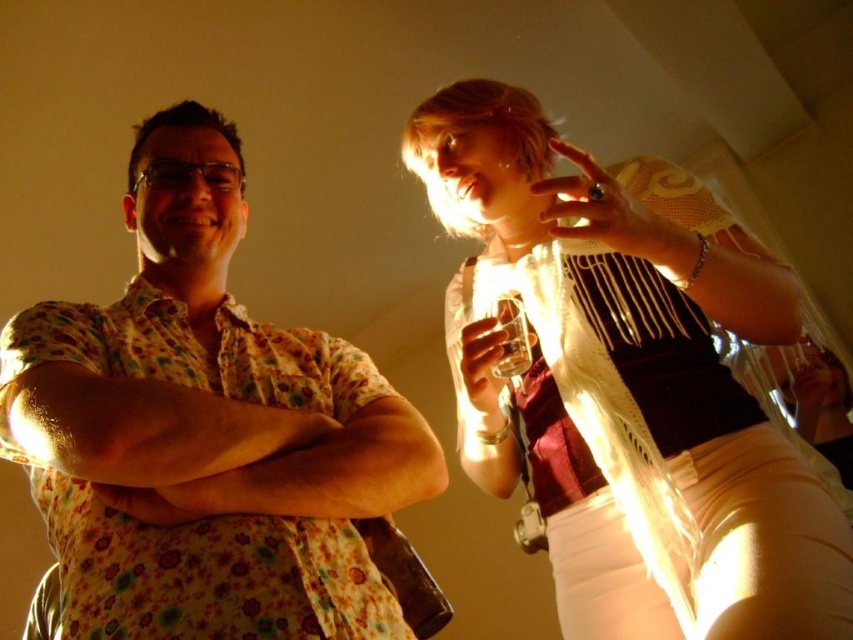
Which of these two, matte white scarf at upper right or floral cotton shirt at left, stands shorter?

Standing shorter between the two is floral cotton shirt at left.

Between matte white scarf at upper right and floral cotton shirt at left, which one is positioned lower?

matte white scarf at upper right is lower down.

Does point (668, 172) come behind point (189, 422)?

Yes, it is.

Where is `matte white scarf at upper right`? matte white scarf at upper right is located at coordinates (627, 384).